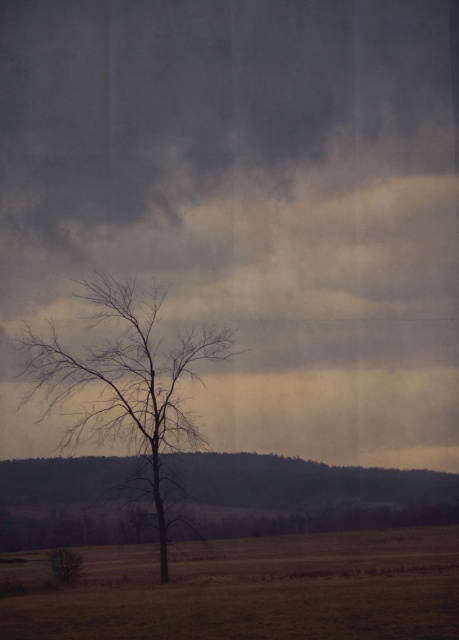
Is gray matte cloud at upper center closer to the viewer compared to bare branches at center?

No, gray matte cloud at upper center is behind bare branches at center.

Is point (22, 180) positioned in front of point (156, 433)?

No, it is not.

Find the location of a particular element. gray matte cloud at upper center is located at coordinates (246, 205).

Can you confirm if gray matte cloud at upper center is taller than brown grassland at center?

Correct, gray matte cloud at upper center is much taller as brown grassland at center.

In the scene shown: Can you confirm if gray matte cloud at upper center is bigger than brown grassland at center?

Indeed, gray matte cloud at upper center has a larger size compared to brown grassland at center.

You are a GUI agent. You are given a task and a screenshot of the screen. Output one action in this format:
    pyautogui.click(x=<x>, y=<y>)
    Task: Click on the gray matte cloud at upper center
    This screenshot has height=640, width=459.
    Given the screenshot: What is the action you would take?
    pyautogui.click(x=246, y=205)

Is brown grassland at center behind bare branches at center?

No, brown grassland at center is closer to the viewer.

Is point (444, 636) closer to camera compared to point (160, 449)?

Yes, it is.

Who is more forward, (408,529) or (104,412)?

Point (104,412) is more forward.

This screenshot has width=459, height=640. Identify the location of brown grassland at center. (256, 589).